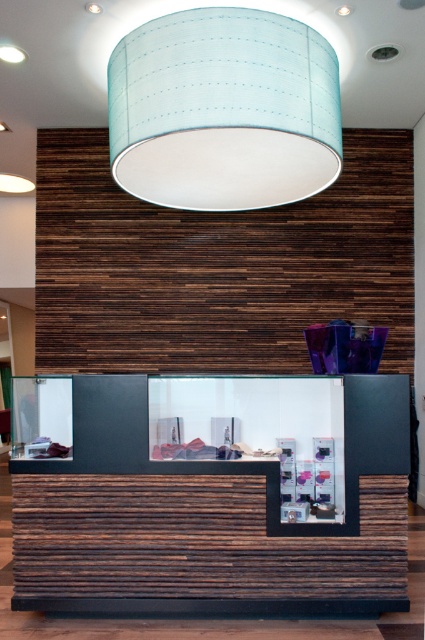
You are a maintenance worker needing to reach the light blue fabric lampshade at upper center to clean it. The wooden reception desk at center is directly below it. Can you use the desk as a stable platform to stand on to reach the lampshade?

The distance between the light blue fabric lampshade at upper center and the wooden reception desk at center is 7.14 feet. Since the desk is directly below the lampshade, you can use it as a stable platform to stand on to reach the lampshade.

You are a customer entering the reception area and want to know which object is taller between the light blue fabric lampshade at upper center and the wooden reception desk at center. Can you determine this?

The light blue fabric lampshade at upper center is not as tall as the wooden reception desk at center, so the wooden reception desk at center is taller.